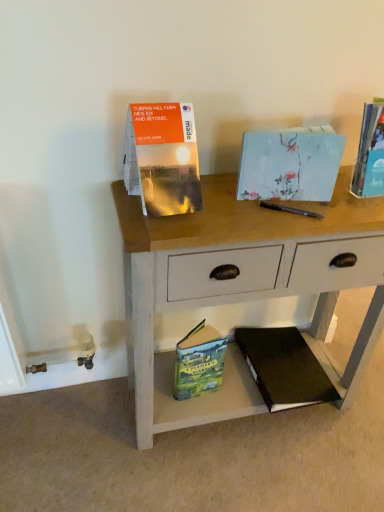
Where is `vacant space to the right of light blue paper at center, the second paperback book from the top`? vacant space to the right of light blue paper at center, the second paperback book from the top is located at coordinates (342, 209).